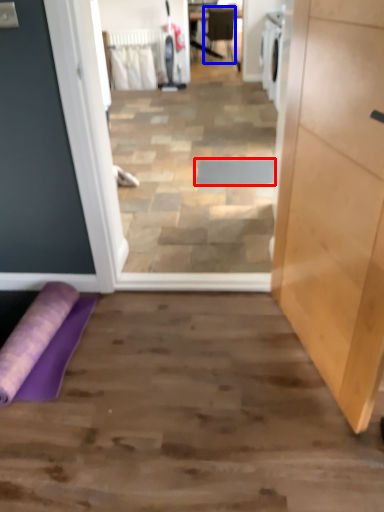
Question: Which object appears closest to the camera in this image, doormat (highlighted by a red box) or chair (highlighted by a blue box)?

Choices:
 (A) doormat
 (B) chair

Answer: (A)